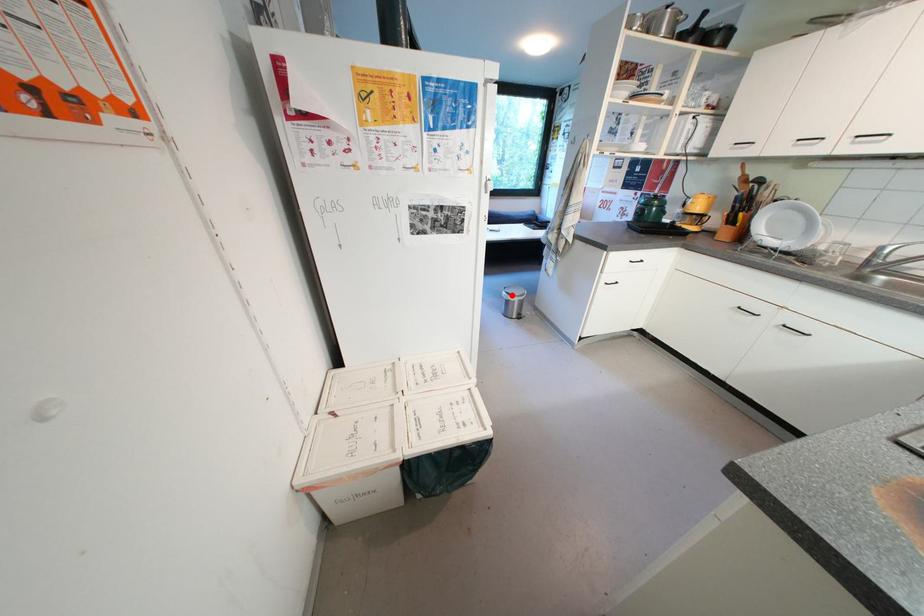
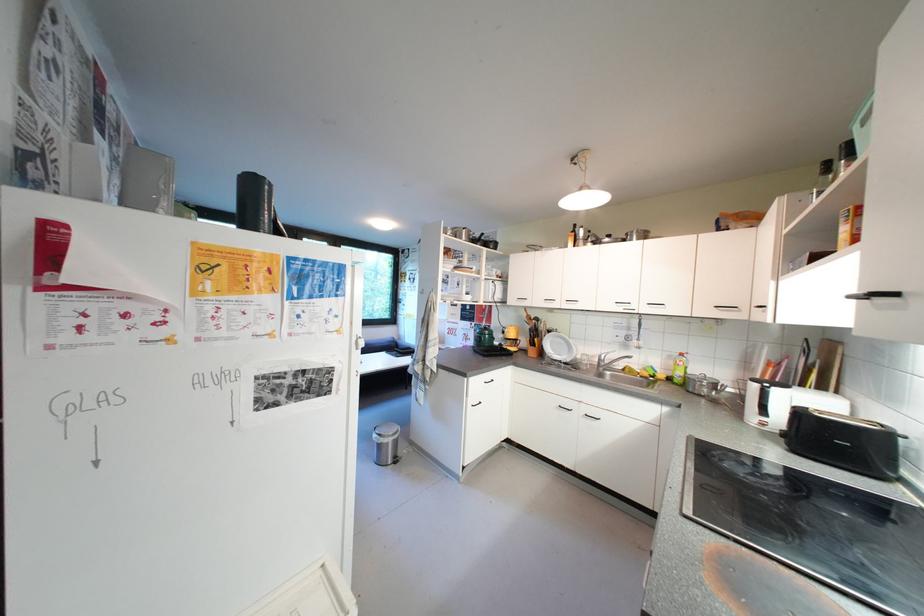
Question: I am providing you with two images of the same scene from different viewpoints. In image1, a red point is highlighted. Considering the same 3D point in image2, which of the following is correct?

Choices:
 (A) It is closer
 (B) It is farther

Answer: (A)